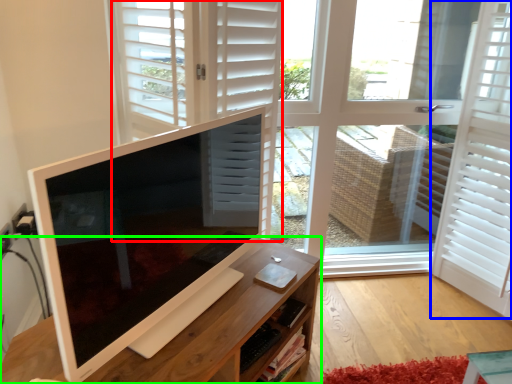
Question: Which object is the closest to the door (highlighted by a red box)? Choose among these: shutter (highlighted by a blue box) or desk (highlighted by a green box).

Choices:
 (A) shutter
 (B) desk

Answer: (B)